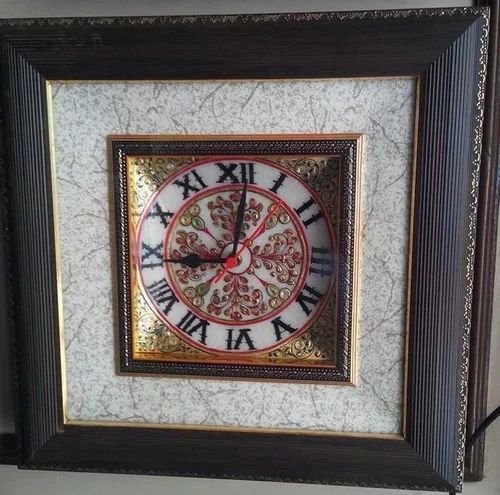
Where is `fancy black scroll work on corners of clock`? fancy black scroll work on corners of clock is located at coordinates (299, 354), (321, 347), (137, 334), (141, 176), (321, 176).